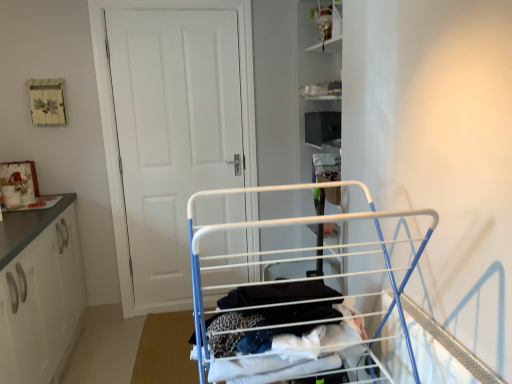
Question: In terms of height, does white fabric clothes at center look taller or shorter compared to white metal drying rack at center?

Choices:
 (A) tall
 (B) short

Answer: (B)

Question: In the image, is white fabric clothes at center positioned in front of or behind white metal drying rack at center?

Choices:
 (A) behind
 (B) front

Answer: (A)

Question: Which is nearer to the white fabric clothes at center?

Choices:
 (A) white matte cabinet at left
 (B) white metal drying rack at center
 (C) matte white cabinet at upper center
 (D) white matte door at center

Answer: (B)

Question: Based on their relative distances, which object is farther from the white fabric clothes at center?

Choices:
 (A) matte white cabinet at upper center
 (B) white matte cabinet at left
 (C) white matte door at center
 (D) white metal drying rack at center

Answer: (A)